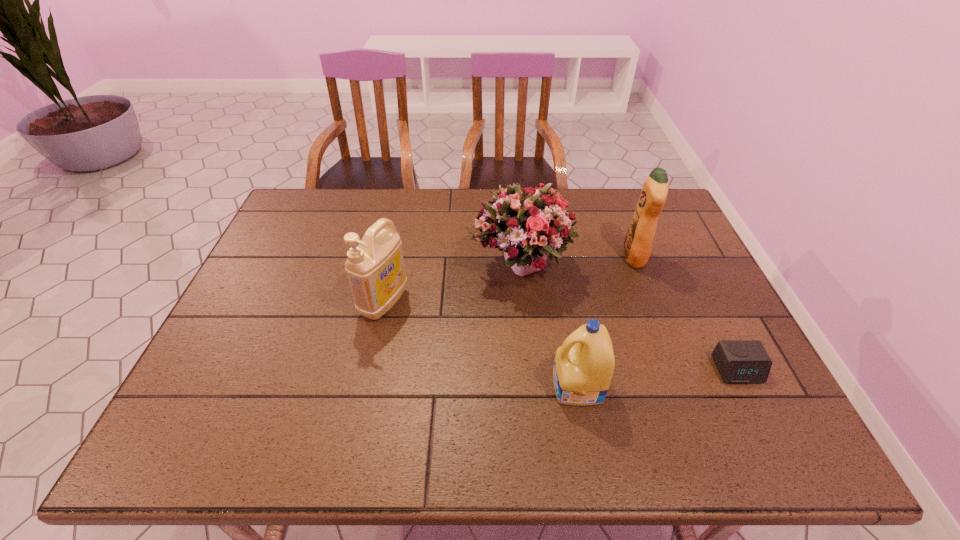
Where is `the rightmost detergent`? The height and width of the screenshot is (540, 960). the rightmost detergent is located at coordinates (638, 242).

At what (x,y) coordinates should I click in order to perform the action: click on the second object from right to left. Please return your answer as a coordinate pair (x, y). The width and height of the screenshot is (960, 540). Looking at the image, I should click on [638, 242].

At what (x,y) coordinates should I click in order to perform the action: click on the leftmost object. Please return your answer as a coordinate pair (x, y). The width and height of the screenshot is (960, 540). Looking at the image, I should click on (375, 269).

You are a GUI agent. You are given a task and a screenshot of the screen. Output one action in this format:
    pyautogui.click(x=<x>, y=<y>)
    Task: Click on the second farthest detergent
    Image resolution: width=960 pixels, height=540 pixels.
    Given the screenshot: What is the action you would take?
    pyautogui.click(x=375, y=269)

You are a GUI agent. You are given a task and a screenshot of the screen. Output one action in this format:
    pyautogui.click(x=<x>, y=<y>)
    Task: Click on the bouquet
    
    Given the screenshot: What is the action you would take?
    pyautogui.click(x=529, y=223)

In order to click on the nearest detergent in this screenshot , I will do `click(584, 364)`.

Find the location of a particular element. This screenshot has width=960, height=540. the second detergent from right to left is located at coordinates (584, 364).

The image size is (960, 540). What are the coordinates of `alarm clock` in the screenshot? It's located at (738, 361).

Identify the location of the shortest object. (738, 361).

I want to click on vacant space located 0.180m on the label of the second object from right to left, so click(563, 257).